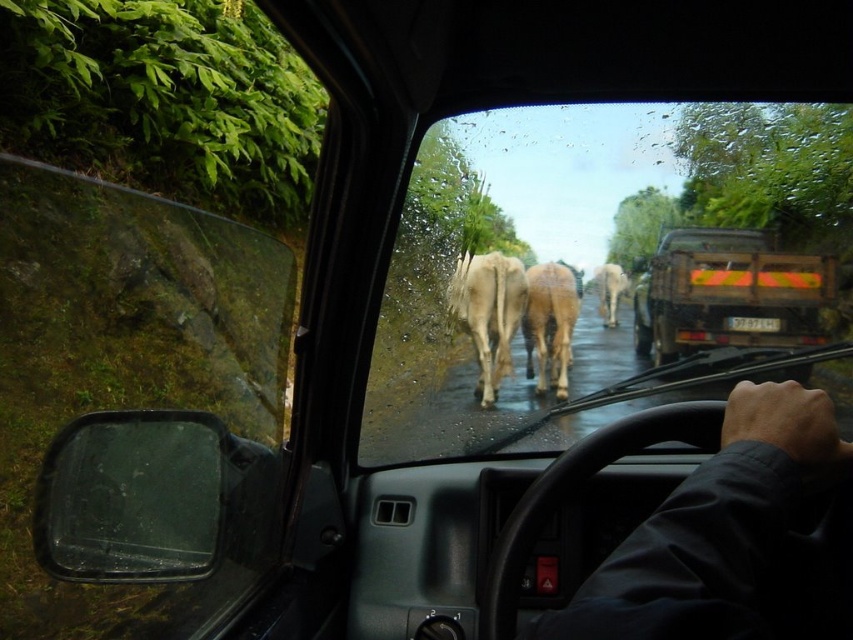
Which is in front, point (618, 566) or point (85, 493)?

Point (618, 566) is in front.

Measure the distance between dark fabric hand at center and camera.

dark fabric hand at center and camera are 26.20 inches apart.

At what (x,y) coordinates should I click in order to perform the action: click on dark fabric hand at center. Please return your answer as a coordinate pair (x, y). Looking at the image, I should click on (715, 531).

Which is below, wooden planks truck at center or light brown fur at center?

light brown fur at center is lower down.

Is point (775, 252) in front of point (529, 368)?

No.

This screenshot has width=853, height=640. I want to click on wooden planks truck at center, so click(x=728, y=292).

Is dark fabric hand at center thinner than light brown fur at center?

In fact, dark fabric hand at center might be wider than light brown fur at center.

Does point (712, 616) come closer to viewer compared to point (538, 292)?

Yes.

Where is `dark fabric hand at center`? This screenshot has width=853, height=640. dark fabric hand at center is located at coordinates (715, 531).